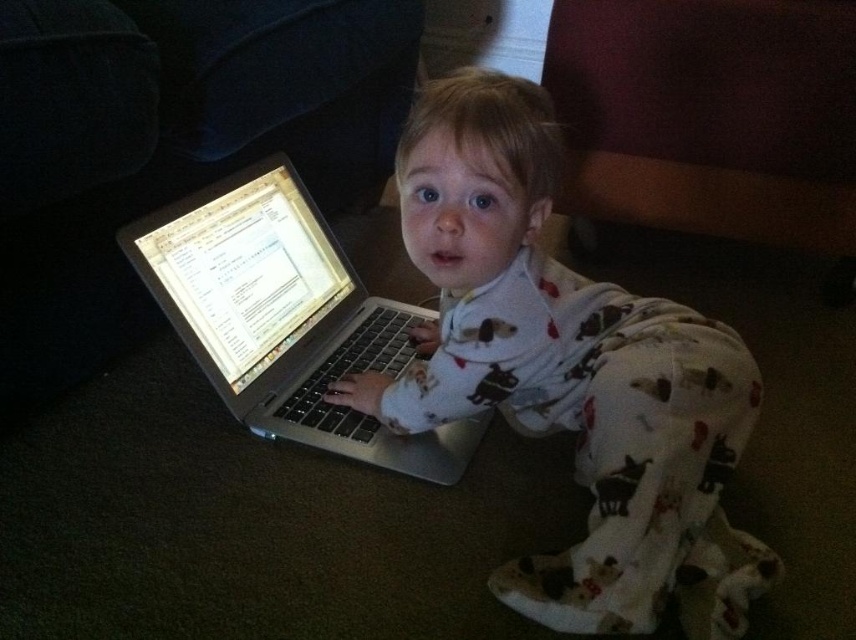
You are a photographer setting up a shot of the child and their laptop. To ensure both the white soft pajamas at center and silver metallic laptop at center are clearly visible, where should you position the light source relative to the camera?

The light source should be positioned to the left of the camera because the white soft pajamas at center are to the right of the silver metallic laptop at center, so placing the light to the left would illuminate both areas effectively without casting shadows over either object.

You are a parent trying to ensure your child is sitting at a proper distance from the laptop. The laptop is placed at point (461, 339) and the child is sitting at point (334, 284). According to the image, which point is closer to the laptop?

Point (461, 339) is in front of point (334, 284), so the child sitting at point (334, 284) is farther away from the laptop. Therefore, the laptop is closer to itself at point (461, 339) than the child.

You are a photographer setting up a shot of the child and the laptop. The white soft pajamas at center and the silver metallic laptop at center are both in the frame. Which object should you focus on to ensure the other is in sharp focus?

Since the white soft pajamas at center is closer to the viewer than the silver metallic laptop at center, focusing on the white soft pajamas at center will ensure the silver metallic laptop at center is also in sharp focus due to the depth of field.